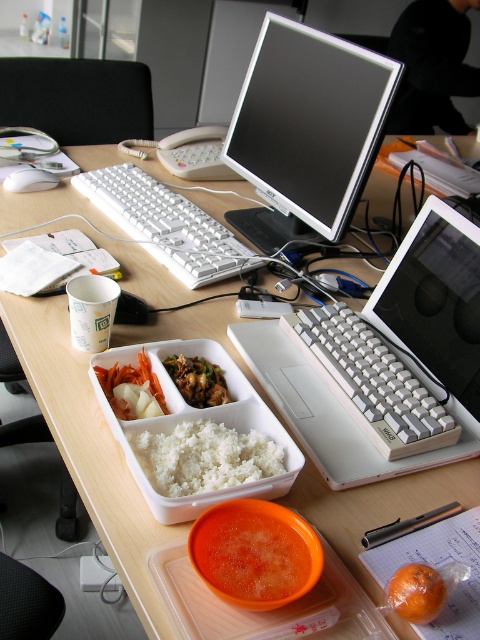
Who is shorter, white plastic laptop at center or matte black monitor at center?

white plastic laptop at center is shorter.

Which is below, white plastic laptop at center or matte black monitor at center?

white plastic laptop at center is below.

Is point (436, 244) more distant than point (315, 92)?

No, (436, 244) is closer to viewer.

Where is `white plastic laptop at center`? Image resolution: width=480 pixels, height=640 pixels. white plastic laptop at center is located at coordinates (383, 360).

Is matte black monitor at center to the right of brown glossy meat at center from the viewer's perspective?

Indeed, matte black monitor at center is positioned on the right side of brown glossy meat at center.

Between matte black monitor at center and brown glossy meat at center, which one appears on the right side from the viewer's perspective?

matte black monitor at center

Where is `matte black monitor at center`? matte black monitor at center is located at coordinates (307, 131).

Is white plastic laptop at center behind white plastic keyboard at center?

No.

Identify the location of white plastic laptop at center. (383, 360).